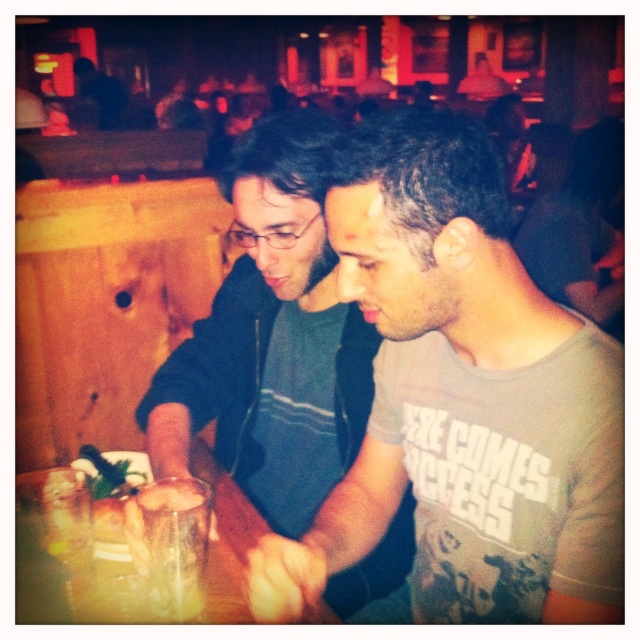
You are a server at the bar and need to place a large tray of drinks on the table. Which object should you use, the translucent glass table at center or the translucent glass at center, and why?

You should use the translucent glass table at center because its width surpasses that of the translucent glass at center, providing a larger surface area for placing the tray of drinks.

From the picture: You are a photographer trying to capture a photo of both the point at (296, 134) and the point at (144, 573) in the scene. Which point should you focus on first to ensure both are in sharp focus?

You should focus on the point at (296, 134) first because it is closer to you than the point at (144, 573). This ensures that the closer point is in focus, and due to depth of field, the farther point may also be acceptably sharp.

You are a photographer trying to capture the perfect shot of the matte black shirt at center. If you want to focus on the exact center of the scene, which coordinates would you aim for?

The exact center of the scene is at coordinates point (320, 320). The matte black shirt at center is located at point (272, 339), which is slightly to the right and below the true center of the scene.